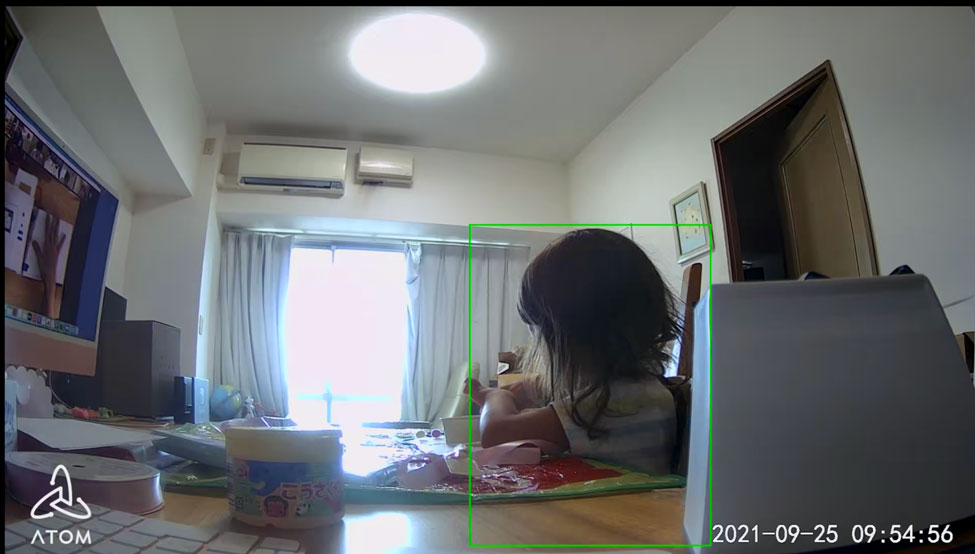
This screenshot has height=554, width=975. What are the coordinates of `keyboards` in the screenshot? It's located at (171, 530).